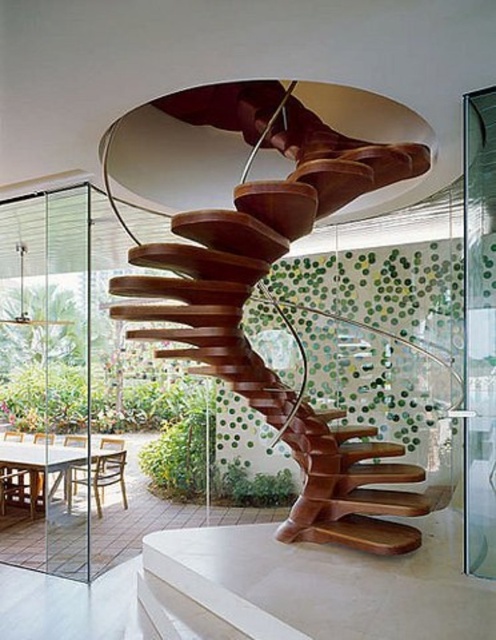
Question: Among these objects, which one is nearest to the camera?

Choices:
 (A) transparent glass door at right
 (B) wooden spiral staircase at center
 (C) transparent glass door at left

Answer: (B)

Question: Is transparent glass door at left to the left of transparent glass door at right from the viewer's perspective?

Choices:
 (A) no
 (B) yes

Answer: (B)

Question: Which object appears closest to the camera in this image?

Choices:
 (A) transparent glass door at right
 (B) wooden spiral staircase at center
 (C) transparent glass door at left

Answer: (B)

Question: Is transparent glass door at left to the left of transparent glass door at right from the viewer's perspective?

Choices:
 (A) no
 (B) yes

Answer: (B)

Question: Which point is farther to the camera?

Choices:
 (A) (472, 376)
 (B) (86, 237)

Answer: (B)

Question: Does transparent glass door at left come in front of transparent glass door at right?

Choices:
 (A) no
 (B) yes

Answer: (A)